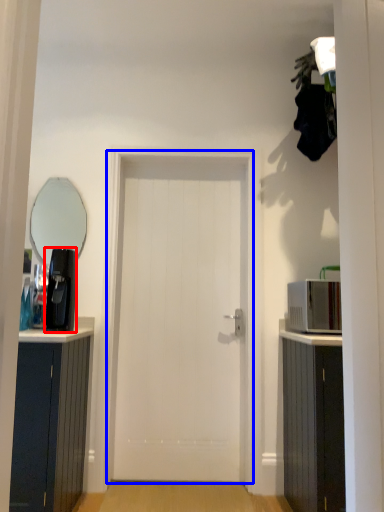
Question: Among these objects, which one is nearest to the camera, coffee machine (highlighted by a red box) or door (highlighted by a blue box)?

Choices:
 (A) coffee machine
 (B) door

Answer: (A)